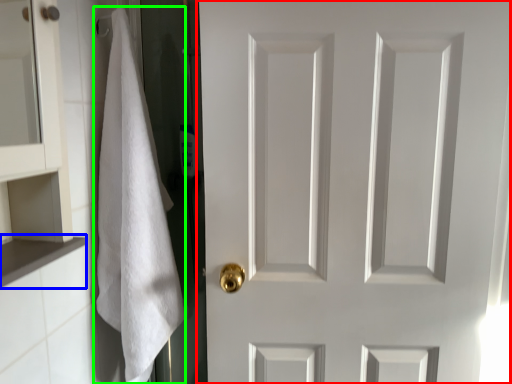
Question: Considering the real-world distances, which object is farthest from door (highlighted by a red box)? cabinet (highlighted by a blue box) or bath towel (highlighted by a green box)?

Choices:
 (A) cabinet
 (B) bath towel

Answer: (A)